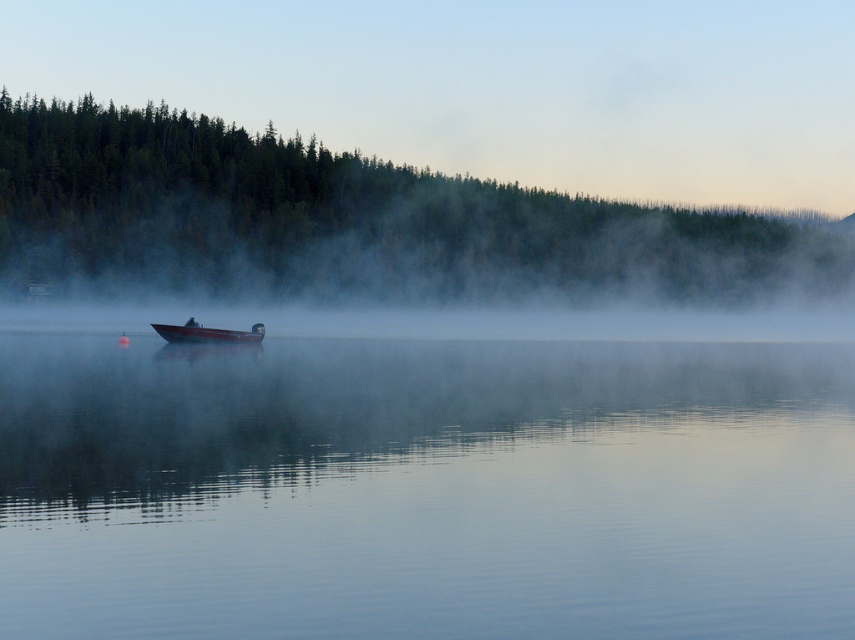
Question: In this image, where is clear water at center located relative to metallic red boat at center?

Choices:
 (A) left
 (B) right

Answer: (B)

Question: Does clear water at center appear over metallic red boat at center?

Choices:
 (A) no
 (B) yes

Answer: (A)

Question: Which point is closer to the camera?

Choices:
 (A) clear water at center
 (B) metallic red boat at center

Answer: (A)

Question: Does clear water at center have a greater width compared to metallic red boat at center?

Choices:
 (A) yes
 (B) no

Answer: (A)

Question: Which of the following is the farthest from the observer?

Choices:
 (A) (169, 326)
 (B) (738, 362)

Answer: (B)